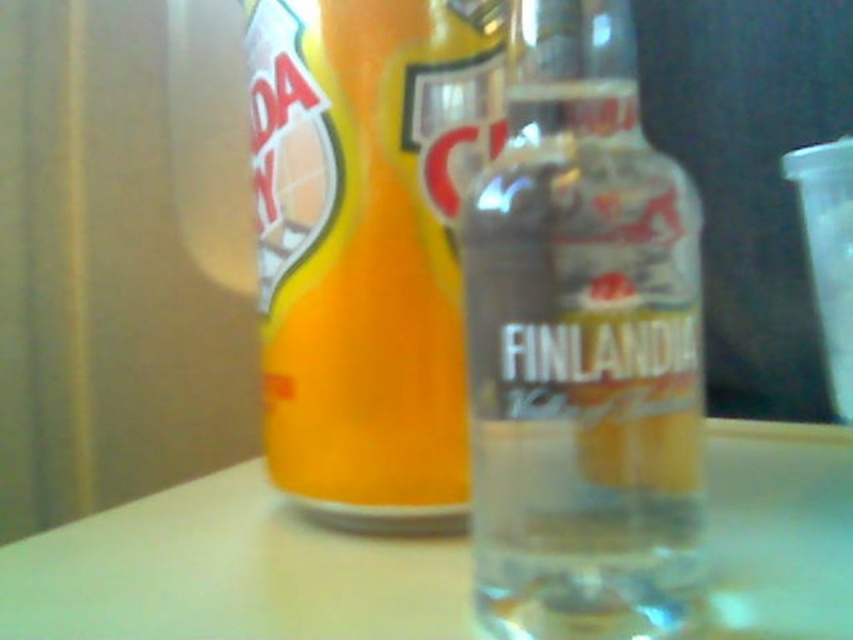
You are a photographer setting up a shot of the clear glass bottle at center and the white glossy table at center. Which object should you focus on first if you want to ensure the bottle is sharp?

The clear glass bottle at center is closer to the viewer than the white glossy table at center, so you should focus on the clear glass bottle at center first to ensure it is sharp.

Looking at this image, you are at a party and need to grab the transparent plastic shot glass at upper right to pour a drink. Which direction should you move your hand relative to the orange matte can at center to reach it?

The transparent plastic shot glass at upper right is to the right of the orange matte can at center, so you should move your hand to the right of the orange matte can at center to reach it.